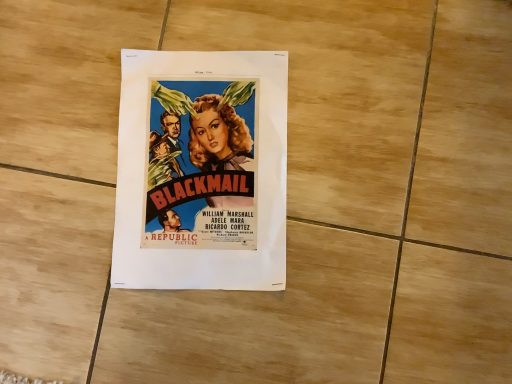
You are a GUI agent. You are given a task and a screenshot of the screen. Output one action in this format:
    pyautogui.click(x=<x>, y=<y>)
    Task: Click on the matte paper poster at center
    The image size is (512, 384).
    Given the screenshot: What is the action you would take?
    (201, 171)

Measure the distance between matte paper poster at center and camera.

matte paper poster at center is 19.91 inches from camera.

Describe the element at coordinates (201, 171) in the screenshot. I see `matte paper poster at center` at that location.

Find the location of a particular element. This screenshot has width=512, height=384. matte paper poster at center is located at coordinates (201, 171).